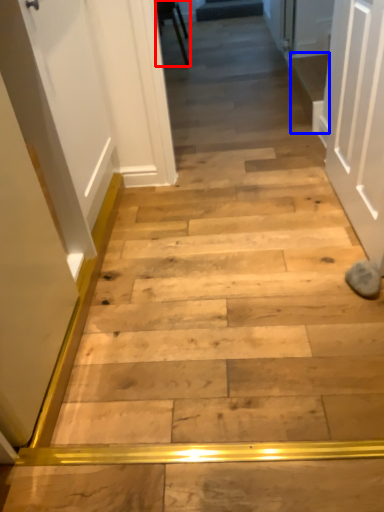
Question: Which of the following is the farthest to the observer, furniture (highlighted by a red box) or stairwell (highlighted by a blue box)?

Choices:
 (A) furniture
 (B) stairwell

Answer: (A)